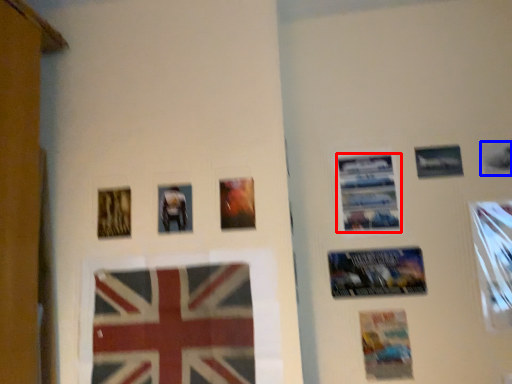
Question: Which object is further to the camera taking this photo, poster (highlighted by a red box) or picture frame (highlighted by a blue box)?

Choices:
 (A) poster
 (B) picture frame

Answer: (A)